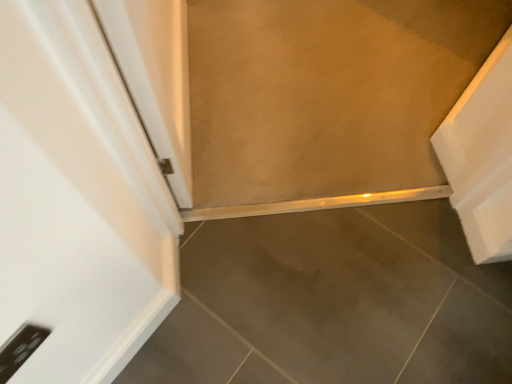
What do you see at coordinates (20, 348) in the screenshot?
I see `black plastic remote control at lower left` at bounding box center [20, 348].

Identify the location of black plastic remote control at lower left. The image size is (512, 384). (20, 348).

What is the approximate height of black plastic remote control at lower left?

black plastic remote control at lower left is 3.79 inches in height.

Locate an element on the screen. The image size is (512, 384). black plastic remote control at lower left is located at coordinates (20, 348).